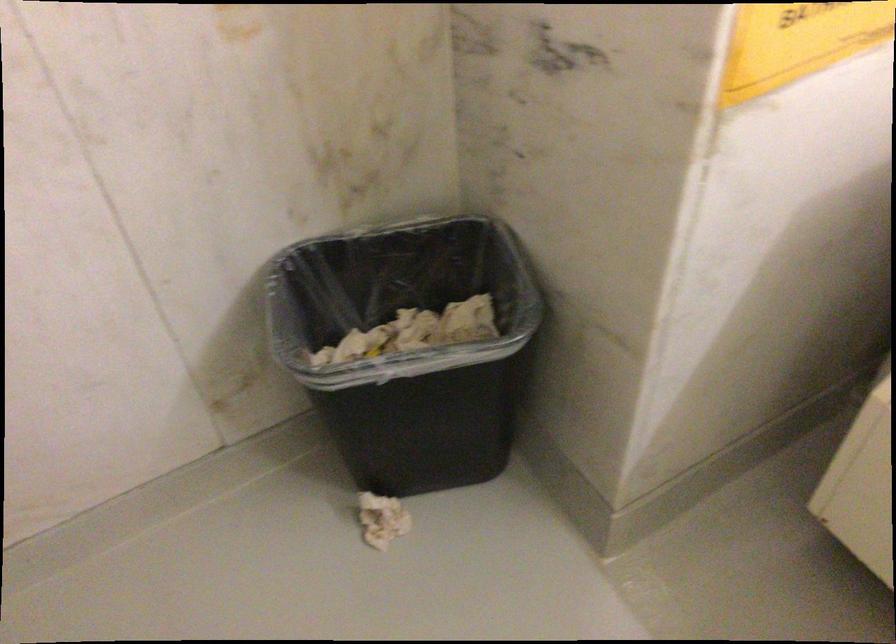
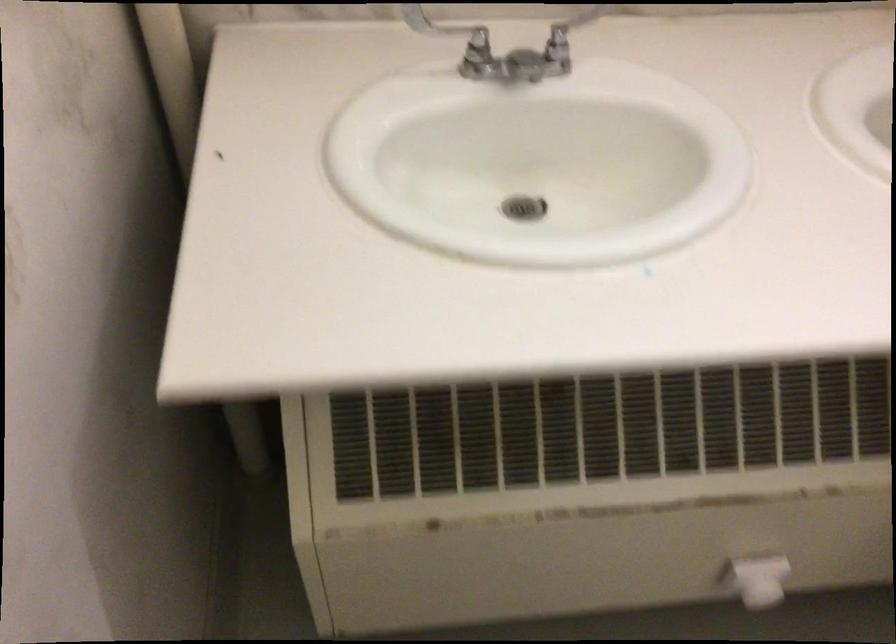
In the scene shown: How did the camera likely rotate?

The camera rotated toward right-down.